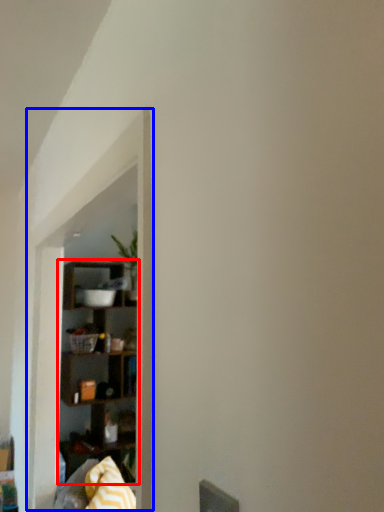
Question: Among these objects, which one is farthest to the camera, shelf (highlighted by a red box) or window sill (highlighted by a blue box)?

Choices:
 (A) shelf
 (B) window sill

Answer: (A)